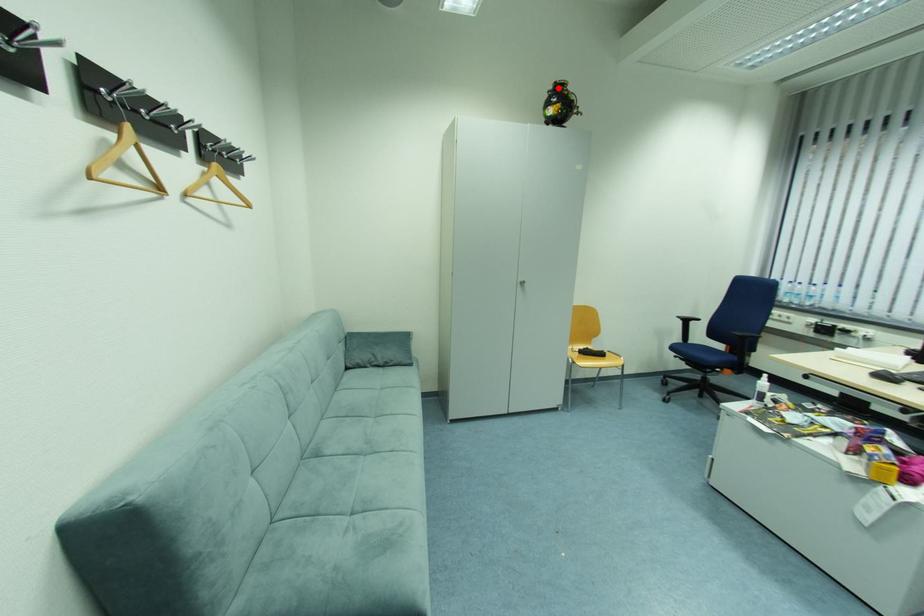
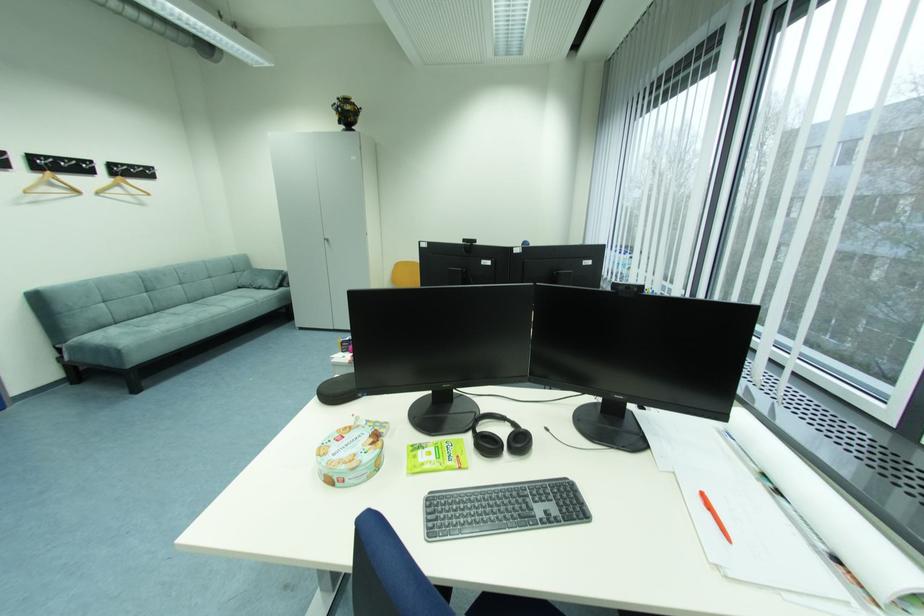
Question: I am providing you with two images of the same scene from different viewpoints. A red point is marked on the first image. At the location where the point appears in image 1, is it still visible in image 2?

Choices:
 (A) Yes
 (B) No

Answer: (A)